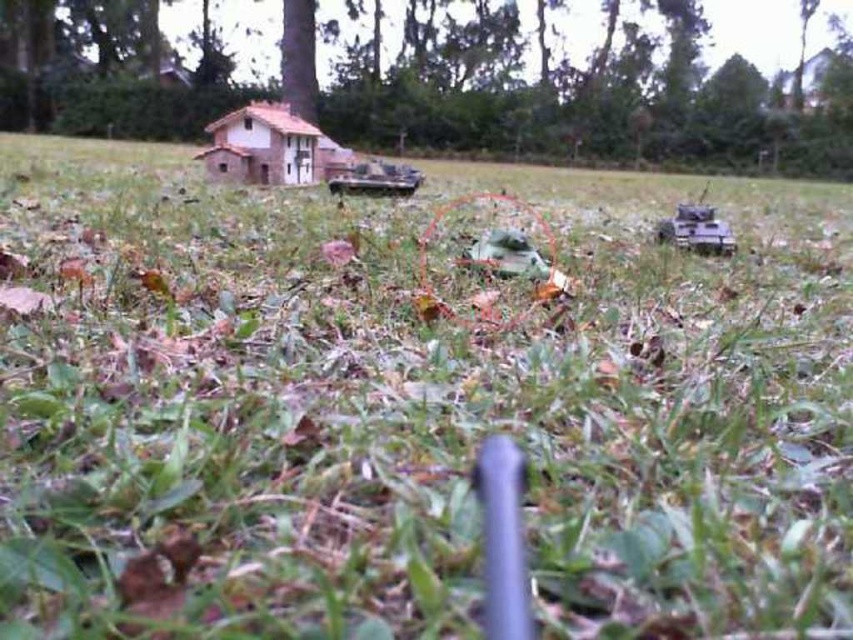
You are setting up a model train layout and need to place the brown wood tree at upper center and the green matte toy car at center. Given their sizes, which object will occupy more space on the layout?

The brown wood tree at upper center will occupy more space on the layout because its width is larger than that of the green matte toy car at center.

In the scene shown: You are setting up a model display and need to arrange the green matte tree at upper center and the purple matte tank at right. Based on their sizes, which object should you place first to ensure proper spacing?

The green matte tree at upper center might be wider than the purple matte tank at right, so you should place the green matte tree at upper center first to allow enough space for both objects.